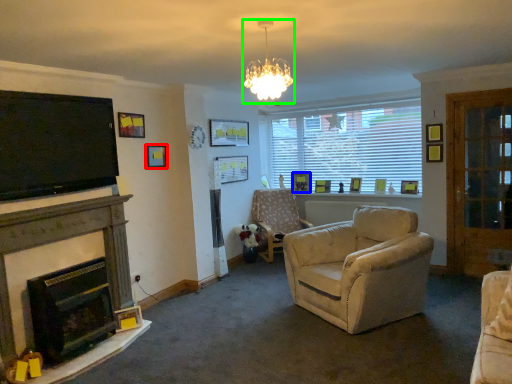
Question: Considering the real-world distances, which object is closest to picture frame (highlighted by a red box)? picture frame (highlighted by a blue box) or light fixture (highlighted by a green box).

Choices:
 (A) picture frame
 (B) light fixture

Answer: (B)